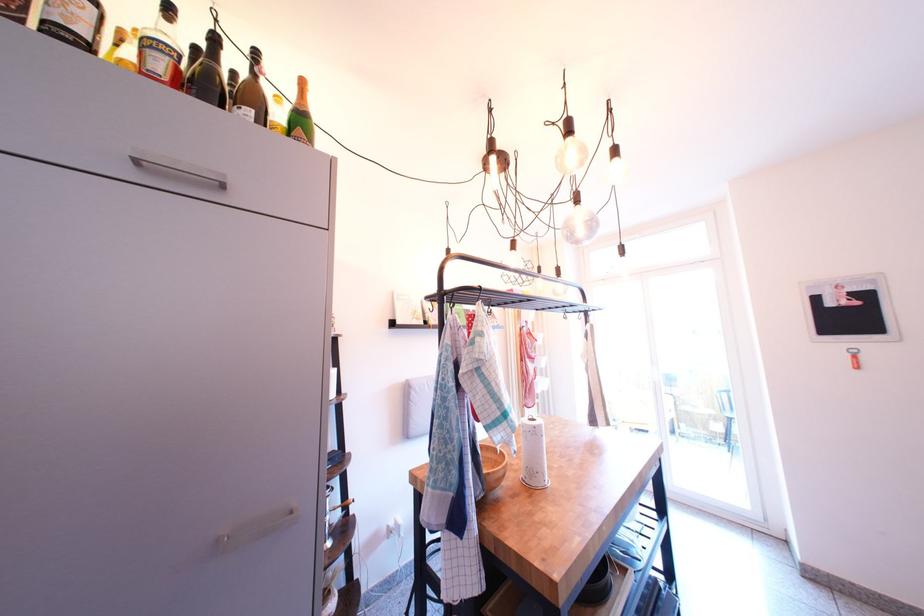
Where would you pull the upper cabinet handle? Please return your answer as a coordinate pair (x, y).

(176, 166)